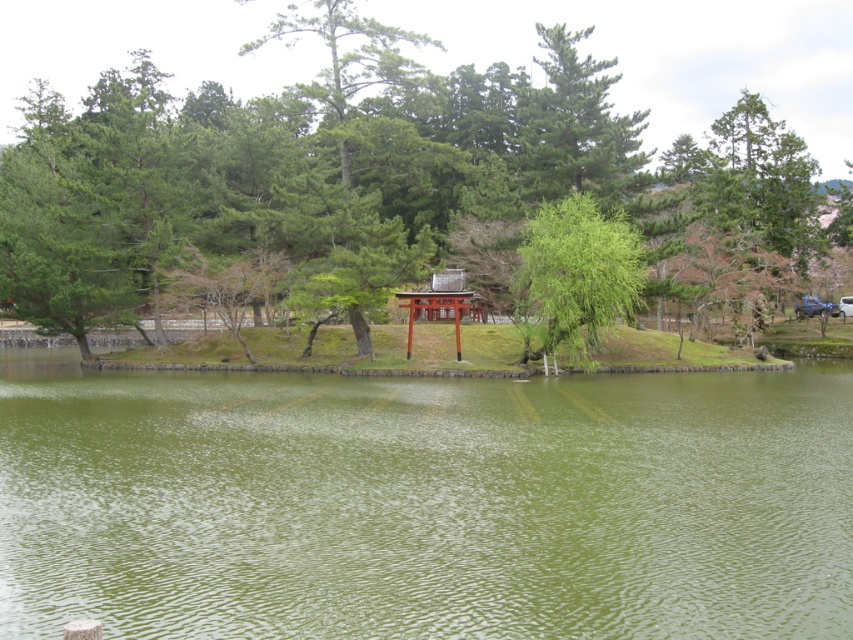
Can you confirm if green smooth water at center is taller than green matte tree at center?

In fact, green smooth water at center may be shorter than green matte tree at center.

Who is more forward, (271,442) or (120,56)?

Positioned in front is point (271,442).

Which is in front, point (231, 628) or point (675, 100)?

Positioned in front is point (231, 628).

Where is `green smooth water at center`? The image size is (853, 640). green smooth water at center is located at coordinates (424, 502).

Does green smooth water at center have a lesser width compared to green leafy tree at center?

Incorrect, green smooth water at center's width is not less than green leafy tree at center's.

Which is below, green smooth water at center or green leafy tree at center?

green smooth water at center

Locate an element on the screen. The image size is (853, 640). green smooth water at center is located at coordinates (424, 502).

Where is `green smooth water at center`? The width and height of the screenshot is (853, 640). green smooth water at center is located at coordinates pyautogui.click(x=424, y=502).

Can you confirm if green smooth water at center is thinner than shiny red wood torii gate at center?

No, green smooth water at center is not thinner than shiny red wood torii gate at center.

Can you confirm if green smooth water at center is positioned to the left of shiny red wood torii gate at center?

Indeed, green smooth water at center is positioned on the left side of shiny red wood torii gate at center.

Image resolution: width=853 pixels, height=640 pixels. Describe the element at coordinates (424, 502) in the screenshot. I see `green smooth water at center` at that location.

Where is `green smooth water at center`? This screenshot has height=640, width=853. green smooth water at center is located at coordinates (424, 502).